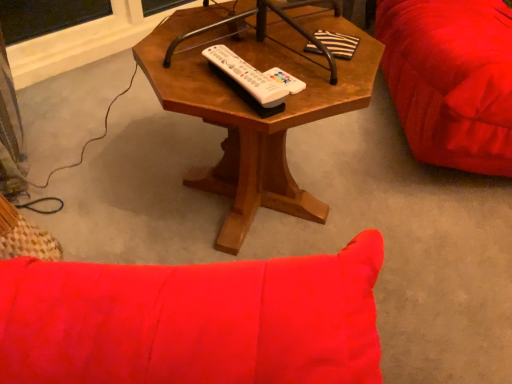
Where is `vacant space to the right of wooden hexagonal table at center`? Image resolution: width=512 pixels, height=384 pixels. vacant space to the right of wooden hexagonal table at center is located at coordinates (414, 215).